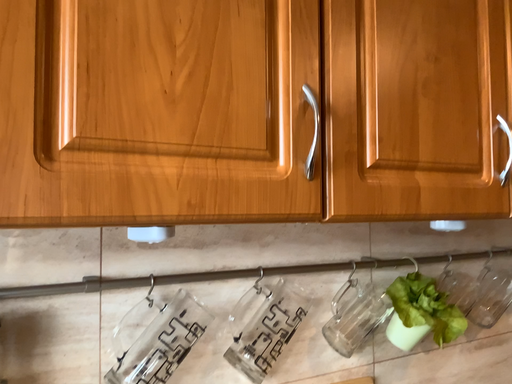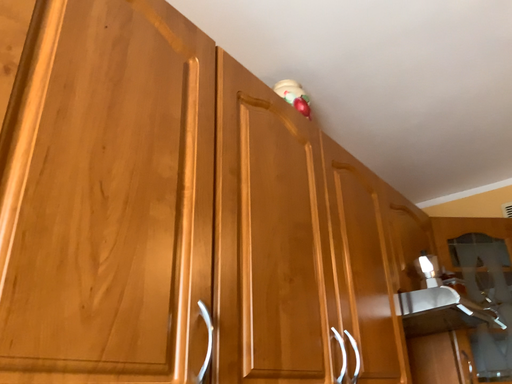
Question: Which way did the camera rotate in the video?

Choices:
 (A) rotated downward
 (B) rotated upward

Answer: (B)